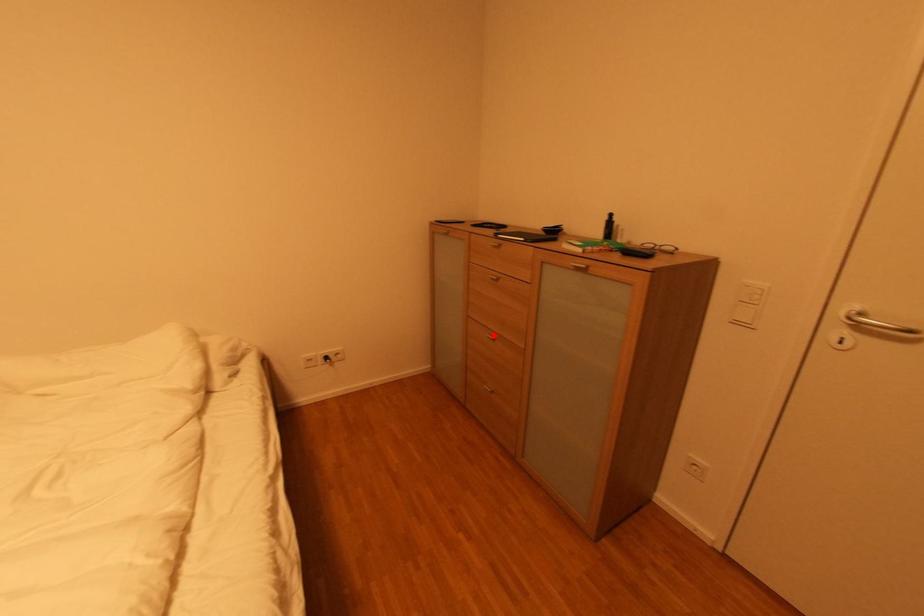
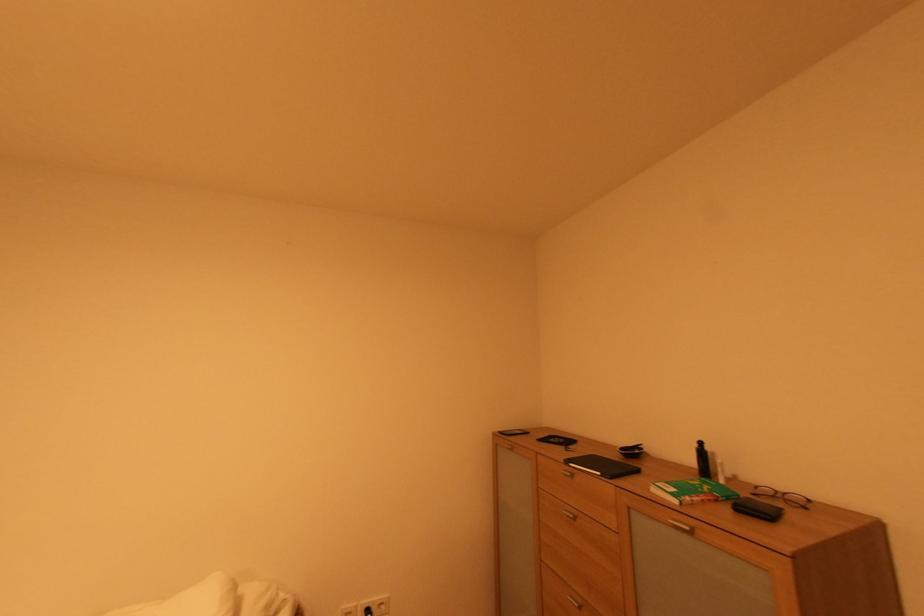
In the second image, find the point that corresponds to the highlighted location in the first image.

(578, 599)